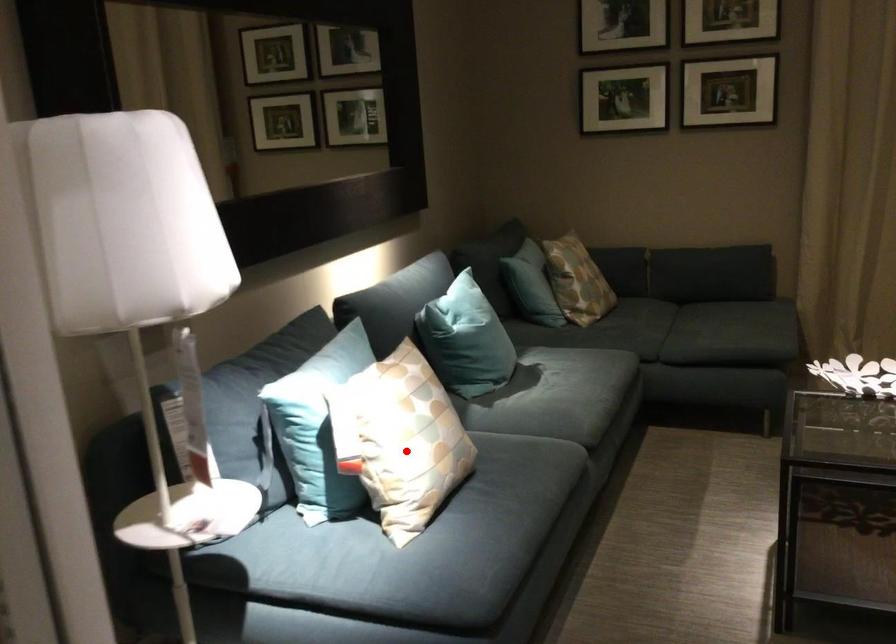
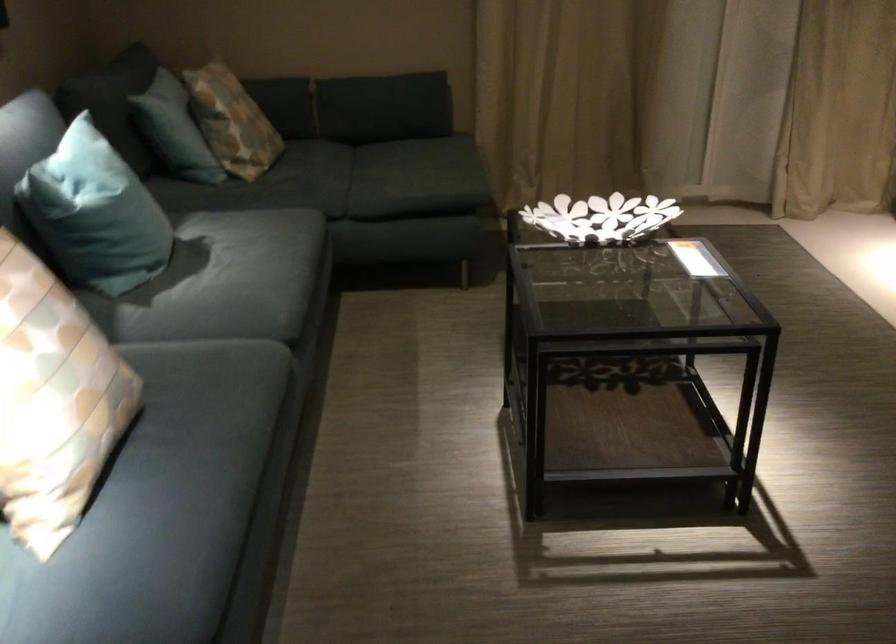
Question: A red point is marked in image1. In image2, is the corresponding 3D point closer to the camera or farther? Reply with the corresponding letter.

Choices:
 (A) The corresponding 3D point is closer.
 (B) The corresponding 3D point is farther.

Answer: (A)